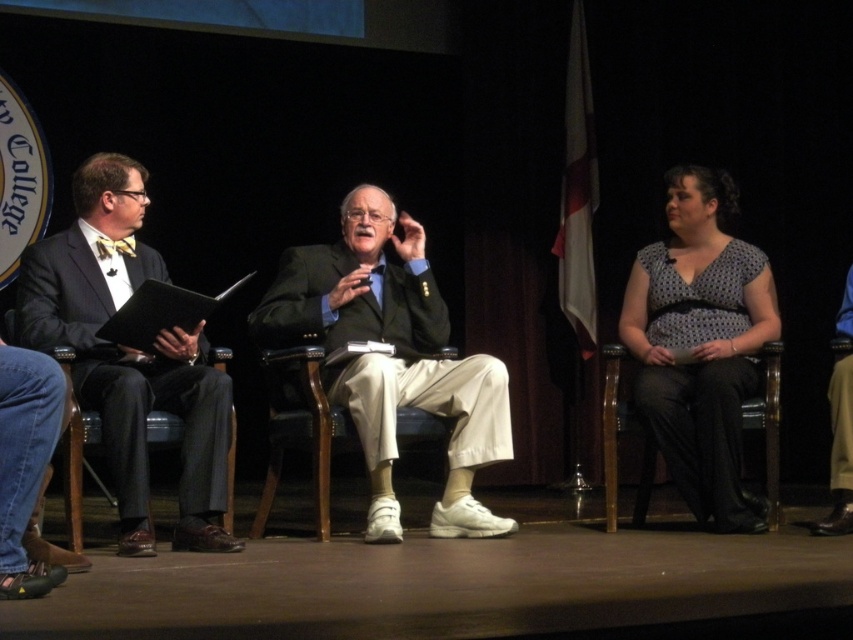
You are sitting in the audience and looking at the stage. There are two points marked on the stage. The first point is at coordinate point (724, 442) and the second point is at coordinate point (325, 500). Which point is closer to you?

Point (325, 500) is closer to you because it is nearer to the camera compared to point (724, 442), which is further away.

You are standing at the origin point of the coordinate system. Where is the wooden chair at center located in terms of coordinates?

The wooden chair at center is located at coordinates point (x=300, y=428).

From the picture: You are an attendee at the panel discussion and want to know which of the two points, point (683, 291) or point (779, 380), is closer to you. Can you determine this based on their positions?

Point (683, 291) is closer to you than point (779, 380) because it is further to the viewer in the image.